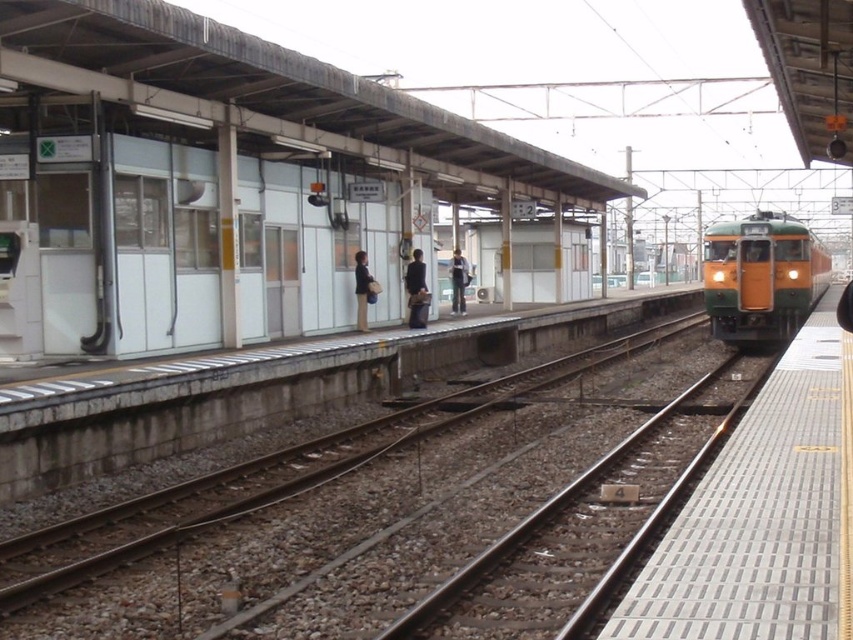
Can you confirm if brown gravel train track at center is positioned to the left of dark blue fabric jacket at center?

Incorrect, brown gravel train track at center is not on the left side of dark blue fabric jacket at center.

Can you confirm if brown gravel train track at center is wider than dark blue fabric jacket at center?

Correct, the width of brown gravel train track at center exceeds that of dark blue fabric jacket at center.

Identify the location of brown gravel train track at center. The height and width of the screenshot is (640, 853). (587, 525).

The image size is (853, 640). Identify the location of brown gravel train track at center. (587, 525).

Does gravel train track at center appear under yellow-green metal train at right?

Correct, gravel train track at center is located below yellow-green metal train at right.

Based on the photo, measure the distance between gravel train track at center and yellow-green metal train at right.

They are 10.09 meters apart.

What do you see at coordinates (392, 509) in the screenshot? This screenshot has height=640, width=853. I see `gravel train track at center` at bounding box center [392, 509].

The image size is (853, 640). I want to click on gravel train track at center, so click(392, 509).

Is dark blue fabric jacket at center below dark brown leather jacket at center?

Incorrect, dark blue fabric jacket at center is not positioned below dark brown leather jacket at center.

Who is shorter, dark blue fabric jacket at center or dark brown leather jacket at center?

dark brown leather jacket at center

Is point (413, 324) behind point (363, 305)?

Yes, it is.

The width and height of the screenshot is (853, 640). I want to click on dark blue fabric jacket at center, so click(416, 291).